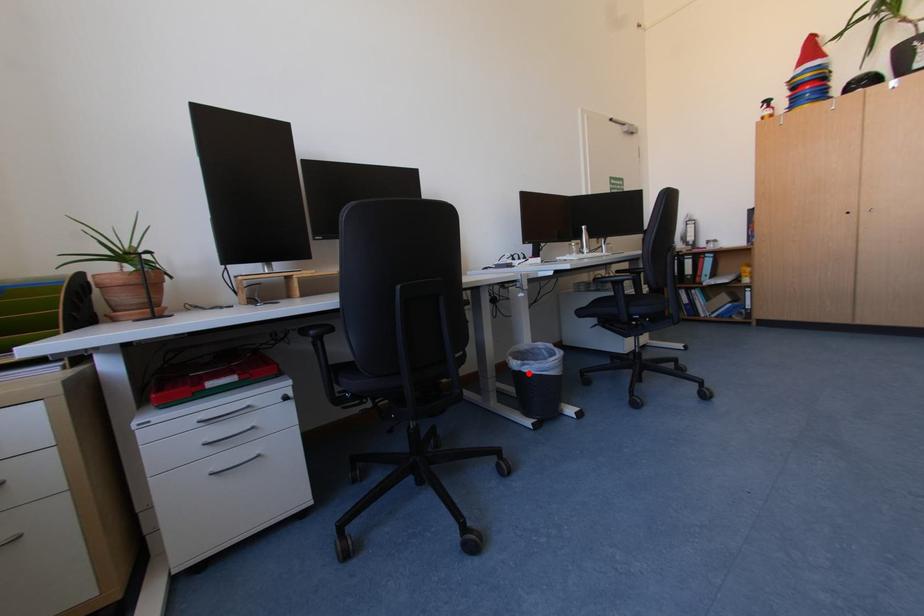
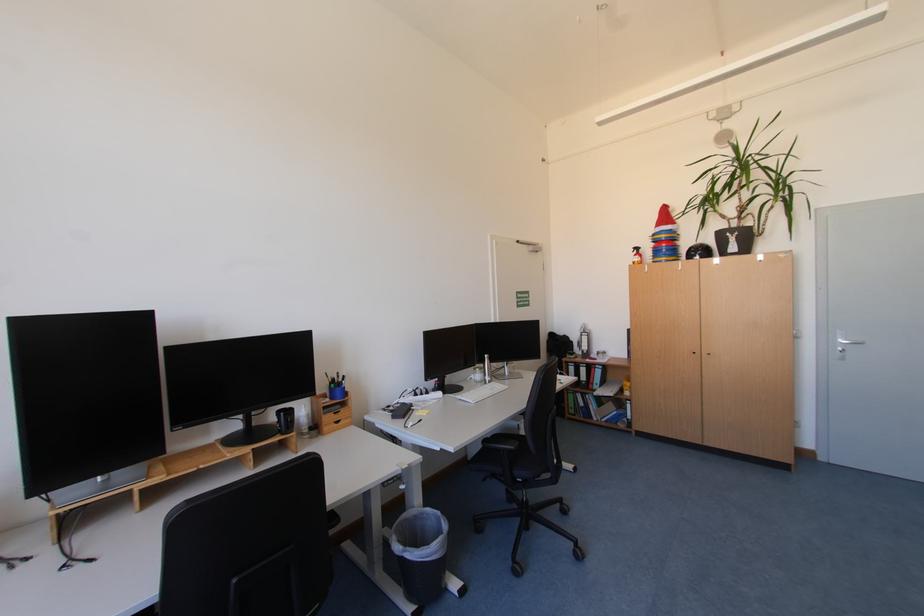
Question: I am providing you with two images of the same scene from different viewpoints. In image1, a red point is highlighted. Considering the same 3D point in image2, which of the following is correct?

Choices:
 (A) It is closer
 (B) It is farther

Answer: (A)